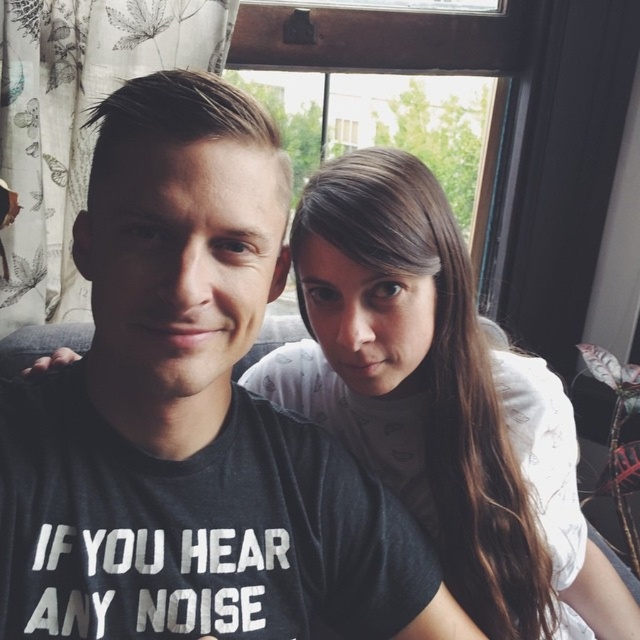
Question: Which object appears farthest from the camera in this image?

Choices:
 (A) matte black t-shirt at center
 (B) white matte shirt at upper right

Answer: (B)

Question: Does matte black t-shirt at center appear over white matte shirt at upper right?

Choices:
 (A) yes
 (B) no

Answer: (A)

Question: Which point is closer to the camera taking this photo?

Choices:
 (A) (264, 486)
 (B) (385, 477)

Answer: (A)

Question: Can you confirm if matte black t-shirt at center is bigger than white matte shirt at upper right?

Choices:
 (A) yes
 (B) no

Answer: (B)

Question: Does matte black t-shirt at center appear on the left side of white matte shirt at upper right?

Choices:
 (A) no
 (B) yes

Answer: (B)

Question: Which point is farther from the camera taking this photo?

Choices:
 (A) (451, 269)
 (B) (163, 90)

Answer: (A)